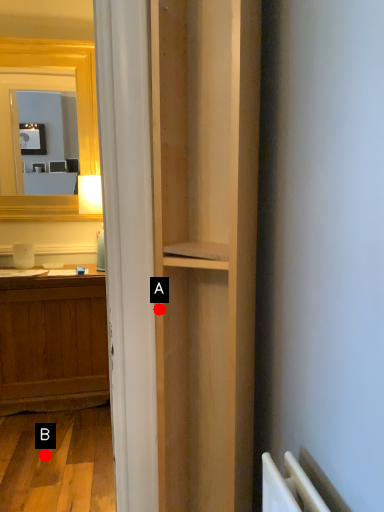
Question: Two points are circled on the image, labeled by A and B beside each circle. Which point is farther from the camera taking this photo?

Choices:
 (A) A is further
 (B) B is further

Answer: (B)